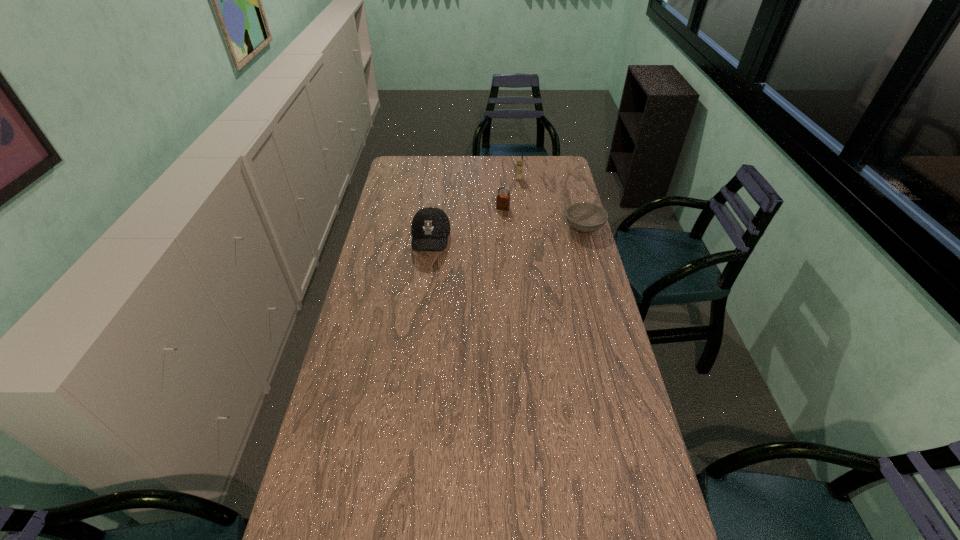
At what (x,y) coordinates should I click in order to perform the action: click on free area in between the baseball cap and the bowl. Please return your answer as a coordinate pair (x, y). This screenshot has height=540, width=960. Looking at the image, I should click on (508, 234).

Identify the location of vacant space in between the shortest object and the baseball cap. pos(508,234).

Locate an element on the screen. object that ranks as the third closest to the leftmost object is located at coordinates (586, 217).

Where is `object that is the third closest one to the rightmost object`? object that is the third closest one to the rightmost object is located at coordinates (430, 228).